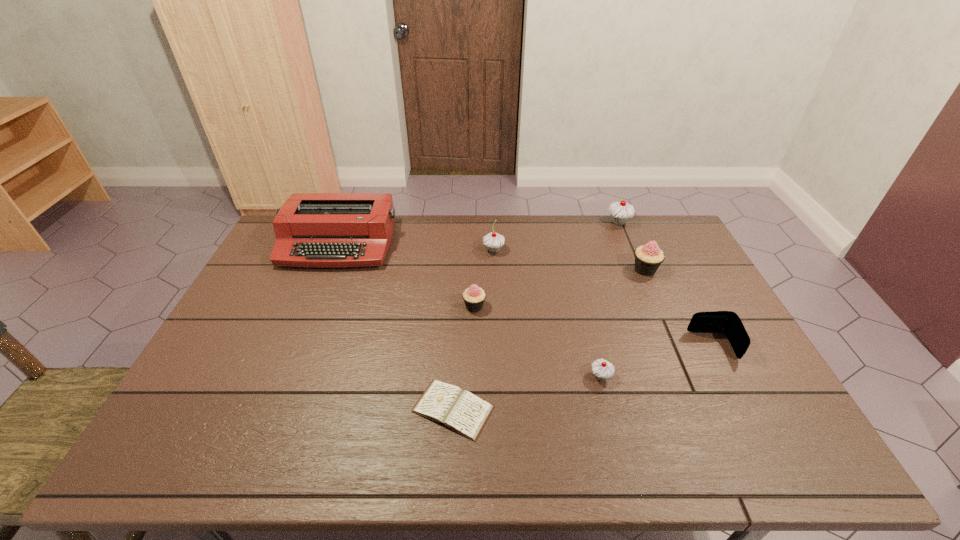
Locate an element on the screen. the nearest cupcake is located at coordinates (602, 369).

Image resolution: width=960 pixels, height=540 pixels. Find the location of `the third cupcake from right to left`. the third cupcake from right to left is located at coordinates (602, 369).

Image resolution: width=960 pixels, height=540 pixels. I want to click on wallet, so click(x=728, y=322).

Where is `diary`? The width and height of the screenshot is (960, 540). diary is located at coordinates (463, 412).

The width and height of the screenshot is (960, 540). In order to click on free region located 0.160m on the front of the farthest gray cupcake in this screenshot , I will do `click(633, 256)`.

Identify the location of free point located 0.100m on the typing side of the red typewriter. Image resolution: width=960 pixels, height=540 pixels. (319, 292).

The width and height of the screenshot is (960, 540). Find the location of `vacant space situated on the front of the second nearest gray cupcake`. vacant space situated on the front of the second nearest gray cupcake is located at coordinates (495, 294).

Locate an element on the screen. The width and height of the screenshot is (960, 540). vacant point located on the front of the third farthest cupcake is located at coordinates (660, 302).

Locate an element on the screen. free space located 0.390m on the left of the left pink cupcake is located at coordinates (335, 307).

Identify the location of free space located 0.390m on the left of the smallest gray cupcake. The image size is (960, 540). (441, 376).